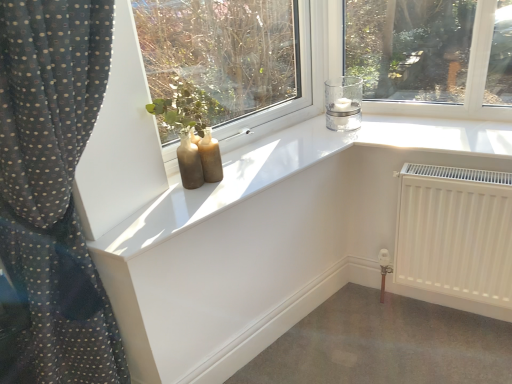
I want to click on vacant area in front of clear glass candle at upper right, so click(x=336, y=143).